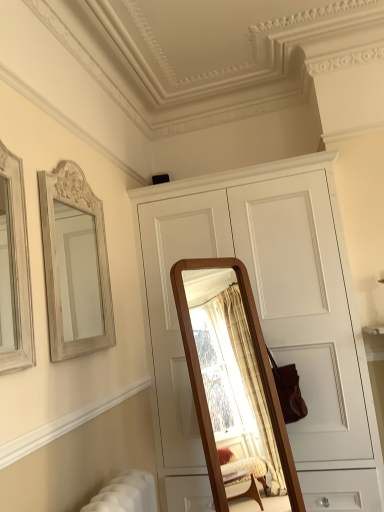
Question: Considering the relative sizes of white wood cabinet at center and wooden frame mirror at left in the image provided, is white wood cabinet at center bigger than wooden frame mirror at left?

Choices:
 (A) yes
 (B) no

Answer: (A)

Question: Is white wood cabinet at center positioned with its back to wooden frame mirror at left?

Choices:
 (A) no
 (B) yes

Answer: (A)

Question: From a real-world perspective, is white wood cabinet at center over wooden frame mirror at left?

Choices:
 (A) no
 (B) yes

Answer: (A)

Question: Does white wood cabinet at center lie behind wooden frame mirror at left?

Choices:
 (A) yes
 (B) no

Answer: (A)

Question: From a real-world perspective, is white wood cabinet at center below wooden frame mirror at left?

Choices:
 (A) no
 (B) yes

Answer: (B)

Question: Relative to white wood cabinet at center, is white carved wood mirror at upper left in front or behind?

Choices:
 (A) front
 (B) behind

Answer: (A)

Question: In the image, is white carved wood mirror at upper left on the left side or the right side of white wood cabinet at center?

Choices:
 (A) right
 (B) left

Answer: (B)

Question: Considering the positions of white carved wood mirror at upper left and white wood cabinet at center in the image, is white carved wood mirror at upper left bigger or smaller than white wood cabinet at center?

Choices:
 (A) big
 (B) small

Answer: (B)

Question: Considering the positions of white carved wood mirror at upper left and white wood cabinet at center in the image, is white carved wood mirror at upper left taller or shorter than white wood cabinet at center?

Choices:
 (A) short
 (B) tall

Answer: (A)

Question: In terms of width, does white carved wood mirror at upper left look wider or thinner when compared to wooden frame mirror at left?

Choices:
 (A) wide
 (B) thin

Answer: (B)

Question: Do you think white carved wood mirror at upper left is within wooden frame mirror at left, or outside of it?

Choices:
 (A) outside
 (B) inside

Answer: (A)

Question: From the image's perspective, is white carved wood mirror at upper left above or below wooden frame mirror at left?

Choices:
 (A) below
 (B) above

Answer: (A)

Question: Looking at the image, does white carved wood mirror at upper left seem bigger or smaller compared to wooden frame mirror at left?

Choices:
 (A) big
 (B) small

Answer: (A)

Question: Considering the positions of point (x=206, y=177) and point (x=66, y=281), is point (x=206, y=177) closer or farther from the camera than point (x=66, y=281)?

Choices:
 (A) closer
 (B) farther

Answer: (A)

Question: From their relative heights in the image, would you say white wood cabinet at center is taller or shorter than white carved wood mirror at upper left?

Choices:
 (A) short
 (B) tall

Answer: (B)